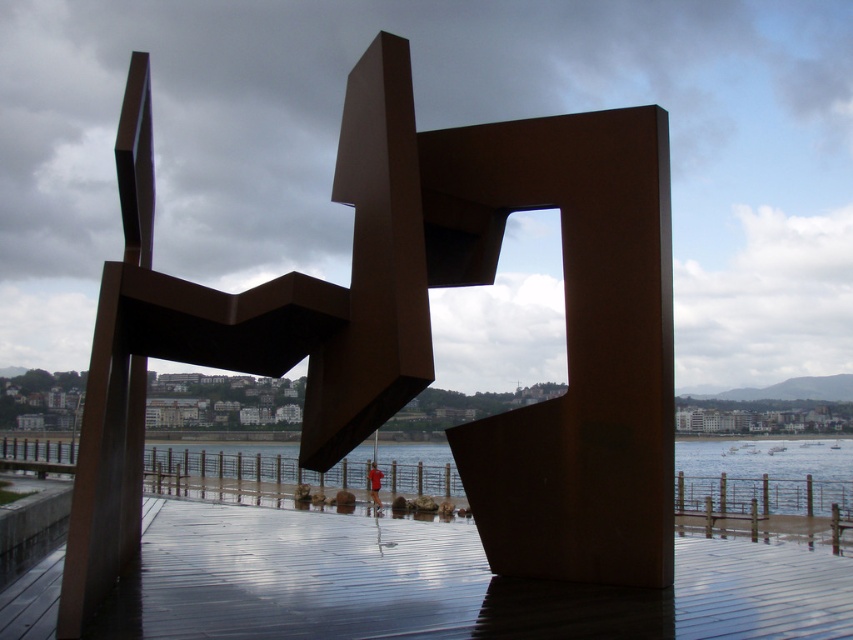
You are a drone operator who needs to fly a drone from the city in the background to the waterfront. The drone has a GPS that can only navigate to coordinates. What are the coordinates of the rusty metal sculpture at center that you should avoid?

The coordinates of the rusty metal sculpture at center are at point (421,330), so you should avoid that point to prevent collision.

You are an art student visiting the waterfront and want to sketch the scene. You need to decide which object to draw first based on their sizes. Which object should you focus on first, the rusty metal sculpture at center or the clear water at lower center?

The clear water at lower center is larger in size compared to the rusty metal sculpture at center, so you should focus on drawing the clear water at lower center first.